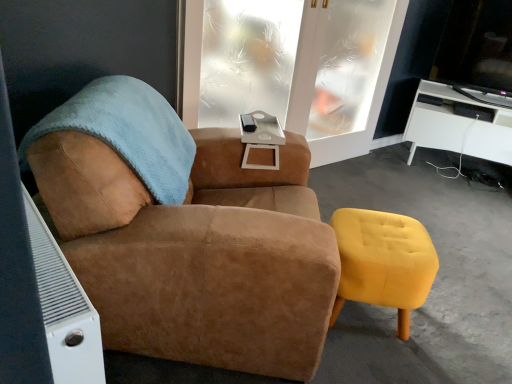
This screenshot has height=384, width=512. In order to click on vacant space in front of yellow velvet stool at lower right in this screenshot , I will do `click(376, 364)`.